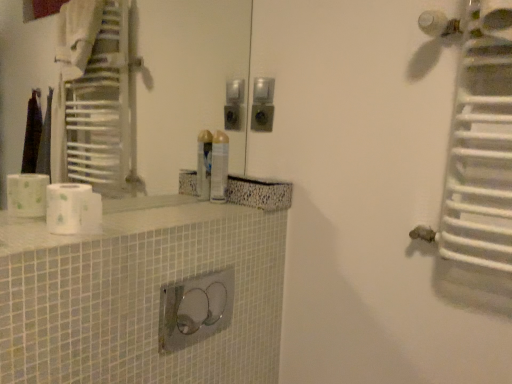
Describe the element at coordinates (481, 143) in the screenshot. This screenshot has height=384, width=512. I see `white metallic radiator at upper right` at that location.

Describe the element at coordinates (73, 209) in the screenshot. I see `white matte toilet paper at left` at that location.

Find the location of a particular element. This screenshot has width=512, height=384. white glossy counter top at center is located at coordinates (110, 224).

Where is `metallic silver spray can at center`? metallic silver spray can at center is located at coordinates (219, 166).

From the image's perspective, relative to white metallic radiator at upper right, is white glossy counter top at center above or below?

From the image's perspective, white glossy counter top at center appears below white metallic radiator at upper right.

Could you tell me if white glossy counter top at center is turned towards white metallic radiator at upper right?

No, white glossy counter top at center is not turned towards white metallic radiator at upper right.

What's the angular difference between white glossy counter top at center and white metallic radiator at upper right's facing directions?

The angular difference between white glossy counter top at center and white metallic radiator at upper right is 89.1 degrees.

In the image, is white glossy counter top at center positioned in front of or behind white metallic radiator at upper right?

Visually, white glossy counter top at center is located in front of white metallic radiator at upper right.

How distant is white matte toilet paper at left from metallic silver spray can at center?

white matte toilet paper at left and metallic silver spray can at center are 20.06 inches apart from each other.

Identify the location of toilet paper that is below the metallic silver spray can at center (from the image's perspective). [x=73, y=209].

Which of these two, white matte toilet paper at left or metallic silver spray can at center, is thinner?

metallic silver spray can at center.

Is metallic silver spray can at center at the back of white matte toilet paper at left?

No, white matte toilet paper at left is not facing away from metallic silver spray can at center.

From the image's perspective, is metallic silver spray can at center positioned above or below white metallic radiator at upper right?

Clearly, from the image's perspective, metallic silver spray can at center is below white metallic radiator at upper right.

Can you confirm if metallic silver spray can at center is taller than white metallic radiator at upper right?

No.

Looking at the image, does metallic silver spray can at center seem bigger or smaller compared to white metallic radiator at upper right?

metallic silver spray can at center is smaller than white metallic radiator at upper right.

Is metallic silver spray can at center not inside white glossy counter top at center?

Yes, metallic silver spray can at center is not within white glossy counter top at center.

Is metallic silver spray can at center at the right side of white glossy counter top at center?

Yes.

Identify the location of counter top that appears on the left of metallic silver spray can at center. (110, 224).

Is metallic silver spray can at center bigger than white glossy counter top at center?

Incorrect, metallic silver spray can at center is not larger than white glossy counter top at center.

Which is farther from the camera, (99, 208) or (455, 203)?

The point (455, 203) is behind.

Find the location of a particular element. The width and height of the screenshot is (512, 384). toilet paper located on the left of white metallic radiator at upper right is located at coordinates (73, 209).

Is white matte toilet paper at left with white metallic radiator at upper right?

They are not placed beside each other.

In the scene shown: Relative to white metallic radiator at upper right, is white matte toilet paper at left in front or behind?

In the image, white matte toilet paper at left appears behind white metallic radiator at upper right.

Locate an element on the screen. This screenshot has width=512, height=384. counter top below the white matte toilet paper at left (from the image's perspective) is located at coordinates (110, 224).

From the image's perspective, between white glossy counter top at center and white matte toilet paper at left, who is located below?

From the image's view, white glossy counter top at center is below.

Is white glossy counter top at center far from white matte toilet paper at left?

white glossy counter top at center is near white matte toilet paper at left, not far away.

Measure the distance from white glossy counter top at center to white matte toilet paper at left.

A: 5.30 inches.

From a real-world perspective, which object stands above the other?

white metallic radiator at upper right.

Which object is further away from the camera taking this photo, white metallic radiator at upper right or white matte toilet paper at left?

Positioned behind is white matte toilet paper at left.

How different are the orientations of white metallic radiator at upper right and white matte toilet paper at left in degrees?

89.7 degrees separate the facing orientations of white metallic radiator at upper right and white matte toilet paper at left.

In terms of size, does white metallic radiator at upper right appear bigger or smaller than white matte toilet paper at left?

Considering their sizes, white metallic radiator at upper right takes up more space than white matte toilet paper at left.

At what (x,y) coordinates should I click in order to perform the action: click on radiator above the white glossy counter top at center (from a real-world perspective). Please return your answer as a coordinate pair (x, y). The width and height of the screenshot is (512, 384). Looking at the image, I should click on (481, 143).

In the image, there is a metallic silver spray can at center. Where is `toilet paper below it (from a real-world perspective)`? This screenshot has height=384, width=512. toilet paper below it (from a real-world perspective) is located at coordinates (73, 209).

From the image, which object appears to be farther from white glossy counter top at center, white metallic radiator at upper right or metallic silver spray can at center?

Result: Based on the image, white metallic radiator at upper right appears to be further to white glossy counter top at center.

Estimate the real-world distances between objects in this image. Which object is further from metallic silver spray can at center, white matte toilet paper at left or white metallic radiator at upper right?

Based on the image, white metallic radiator at upper right appears to be further to metallic silver spray can at center.

When comparing their distances from metallic silver spray can at center, does white metallic radiator at upper right or white glossy counter top at center seem closer?

white glossy counter top at center is closer to metallic silver spray can at center.

Based on their spatial positions, is metallic silver spray can at center or white metallic radiator at upper right closer to white matte toilet paper at left?

metallic silver spray can at center is closer to white matte toilet paper at left.

Which object lies further to the anchor point white matte toilet paper at left, metallic silver spray can at center or white glossy counter top at center?

Based on the image, metallic silver spray can at center appears to be further to white matte toilet paper at left.

Considering their positions, is white matte toilet paper at left positioned further to white glossy counter top at center than white metallic radiator at upper right?

Based on the image, white metallic radiator at upper right appears to be further to white glossy counter top at center.

From the image, which object appears to be farther from metallic silver spray can at center, white metallic radiator at upper right or white matte toilet paper at left?

Among the two, white metallic radiator at upper right is located further to metallic silver spray can at center.

Considering their positions, is white matte toilet paper at left positioned further to white metallic radiator at upper right than metallic silver spray can at center?

white matte toilet paper at left.

Locate an element on the screen. This screenshot has width=512, height=384. toiletry between white glossy counter top at center and white metallic radiator at upper right from left to right is located at coordinates [219, 166].

Locate an element on the screen. toilet paper positioned between white glossy counter top at center and metallic silver spray can at center from near to far is located at coordinates (73, 209).

In order to click on toiletry situated between white matte toilet paper at left and white metallic radiator at upper right from left to right in this screenshot , I will do `click(219, 166)`.

Where is `counter top between white matte toilet paper at left and white metallic radiator at upper right in the horizontal direction`? counter top between white matte toilet paper at left and white metallic radiator at upper right in the horizontal direction is located at coordinates (110, 224).